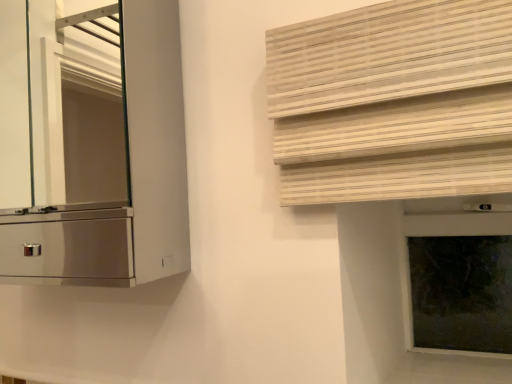
Question: From a real-world perspective, is dark glass window frame at right physically below natural wood blinds at upper right?

Choices:
 (A) yes
 (B) no

Answer: (A)

Question: Does dark glass window frame at right have a greater height compared to natural wood blinds at upper right?

Choices:
 (A) no
 (B) yes

Answer: (B)

Question: Considering the relative sizes of dark glass window frame at right and natural wood blinds at upper right in the image provided, is dark glass window frame at right wider than natural wood blinds at upper right?

Choices:
 (A) yes
 (B) no

Answer: (A)

Question: Are dark glass window frame at right and natural wood blinds at upper right located far from each other?

Choices:
 (A) yes
 (B) no

Answer: (B)

Question: Can you confirm if dark glass window frame at right is shorter than natural wood blinds at upper right?

Choices:
 (A) no
 (B) yes

Answer: (A)

Question: From a real-world perspective, relative to natural wood blinds at upper right, is metallic silver cabinet at left vertically above or below?

Choices:
 (A) below
 (B) above

Answer: (B)

Question: Considering their positions, is metallic silver cabinet at left located in front of or behind natural wood blinds at upper right?

Choices:
 (A) behind
 (B) front

Answer: (A)

Question: Considering the positions of metallic silver cabinet at left and natural wood blinds at upper right in the image, is metallic silver cabinet at left bigger or smaller than natural wood blinds at upper right?

Choices:
 (A) big
 (B) small

Answer: (A)

Question: Is metallic silver cabinet at left situated inside natural wood blinds at upper right or outside?

Choices:
 (A) inside
 (B) outside

Answer: (B)

Question: Do you think dark glass window frame at right is within natural wood blinds at upper right, or outside of it?

Choices:
 (A) outside
 (B) inside

Answer: (A)

Question: Relative to natural wood blinds at upper right, is dark glass window frame at right in front or behind?

Choices:
 (A) front
 (B) behind

Answer: (B)

Question: Looking at the image, does dark glass window frame at right seem bigger or smaller compared to natural wood blinds at upper right?

Choices:
 (A) big
 (B) small

Answer: (B)

Question: In the image, is dark glass window frame at right on the left side or the right side of natural wood blinds at upper right?

Choices:
 (A) left
 (B) right

Answer: (B)

Question: Which is correct: metallic silver cabinet at left is inside dark glass window frame at right, or outside of it?

Choices:
 (A) inside
 (B) outside

Answer: (B)

Question: From the image's perspective, is metallic silver cabinet at left positioned above or below dark glass window frame at right?

Choices:
 (A) below
 (B) above

Answer: (B)